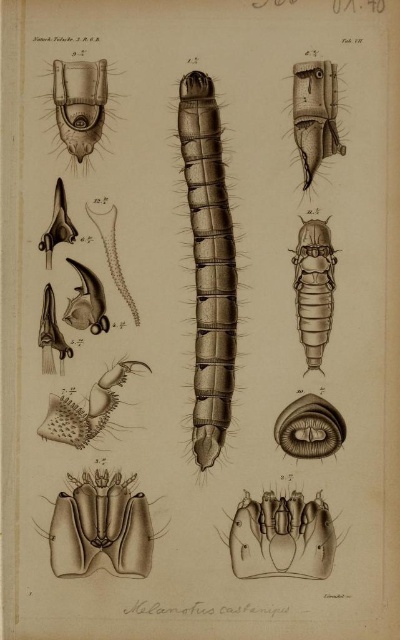
Based on the scene description, which object is closer to the viewer? The brown textured caterpillar at center or the brown matte insect at center?

The brown textured caterpillar at center is closer to the viewer because it is in front of the brown matte insect at center.

Based on the scene description, which object is taller between the brown textured caterpillar at center and the brown matte insect at center?

The brown textured caterpillar at center is taller than the brown matte insect at center according to the description.

You are an entomologist examining this illustration. You need to identify which insect part is bigger between the brown matte insect at center and the brown textured insect at upper right. Which one is larger?

The brown matte insect at center is larger in size than the brown textured insect at upper right.